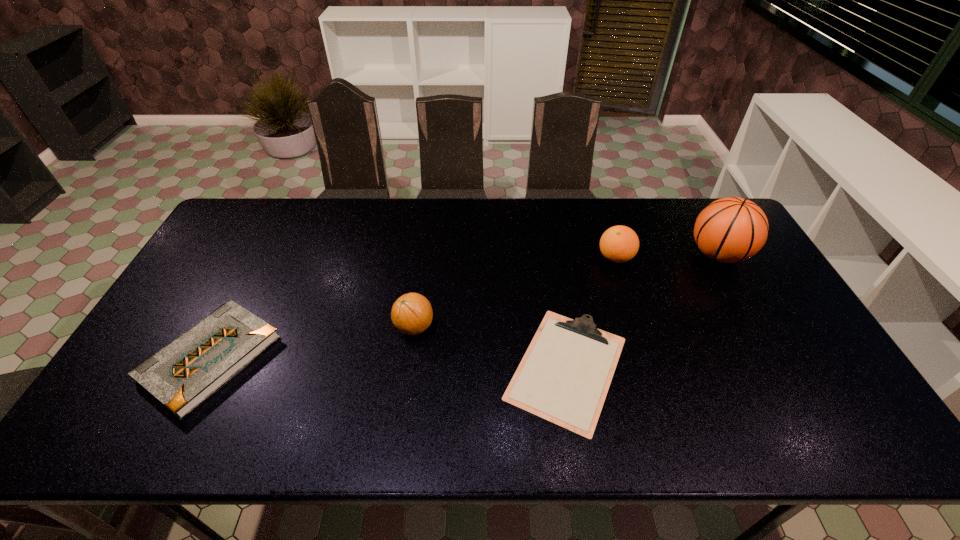
In the image, there is a desktop. Identify the location of vacant space at the far edge. (x=682, y=226).

The height and width of the screenshot is (540, 960). In the image, there is a desktop. In order to click on free space at the left edge in this screenshot , I will do `click(193, 297)`.

Identify the location of free region at the right edge of the desktop. (732, 302).

In the image, there is a desktop. Identify the location of blank space at the far left corner. click(253, 204).

This screenshot has height=540, width=960. Find the location of `free space at the far right corner`. free space at the far right corner is located at coordinates (687, 201).

Where is `free space between the left orange and the shortest object`? free space between the left orange and the shortest object is located at coordinates (491, 347).

Where is `free space between the leftmost object and the nearer orange`? The height and width of the screenshot is (540, 960). free space between the leftmost object and the nearer orange is located at coordinates (313, 342).

At what (x,y) coordinates should I click in order to perform the action: click on free area in between the second object from left to right and the leftmost object. Please return your answer as a coordinate pair (x, y). Looking at the image, I should click on (313, 342).

Find the location of `empty space that is in between the clipboard and the left orange`. empty space that is in between the clipboard and the left orange is located at coordinates (491, 347).

Where is `vacant space in between the clipboard and the farther orange`? Image resolution: width=960 pixels, height=540 pixels. vacant space in between the clipboard and the farther orange is located at coordinates (591, 313).